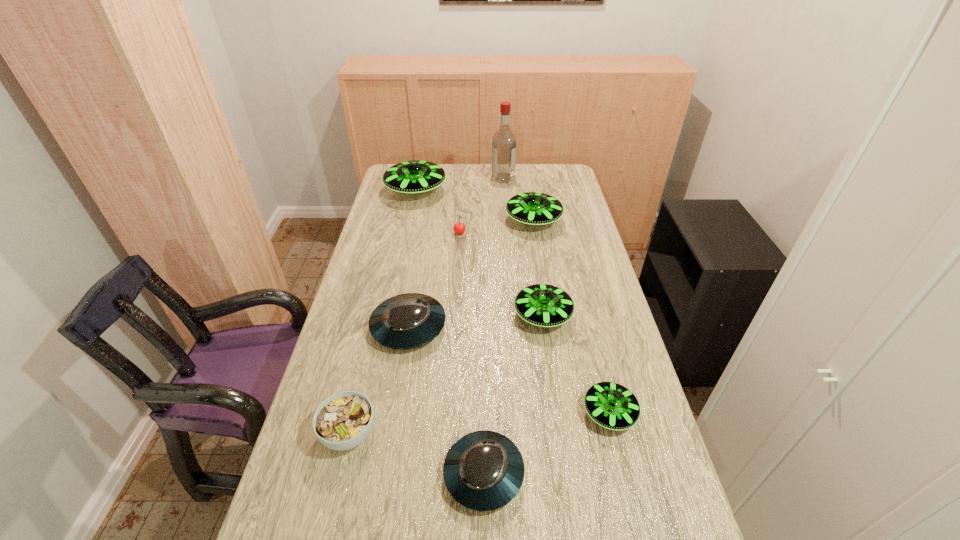
Identify the location of vacant space positioned 0.180m on the right of the white soup bowl. Image resolution: width=960 pixels, height=540 pixels. (453, 434).

Find the location of a particular element. vacant space situated on the back of the smallest green saucer is located at coordinates (590, 338).

Locate an element on the screen. The height and width of the screenshot is (540, 960). free region located on the back of the nearer gray saucer is located at coordinates (483, 315).

This screenshot has width=960, height=540. I want to click on liquor at the far edge, so 504,144.

Locate an element on the screen. saucer at the far edge is located at coordinates (414, 176).

Image resolution: width=960 pixels, height=540 pixels. Find the location of `soup bowl situated at the left edge`. soup bowl situated at the left edge is located at coordinates (344, 420).

Find the location of a particular element. This screenshot has width=960, height=540. object that is at the far left corner is located at coordinates (414, 176).

In the image, there is a desktop. At what (x,y) coordinates should I click in order to perform the action: click on vacant space at the left edge. Please return your answer as a coordinate pair (x, y). Looking at the image, I should click on (325, 453).

The image size is (960, 540). Identify the location of free space at the right edge. 572,268.

The height and width of the screenshot is (540, 960). I want to click on vacant space at the far right corner of the desktop, so click(x=565, y=165).